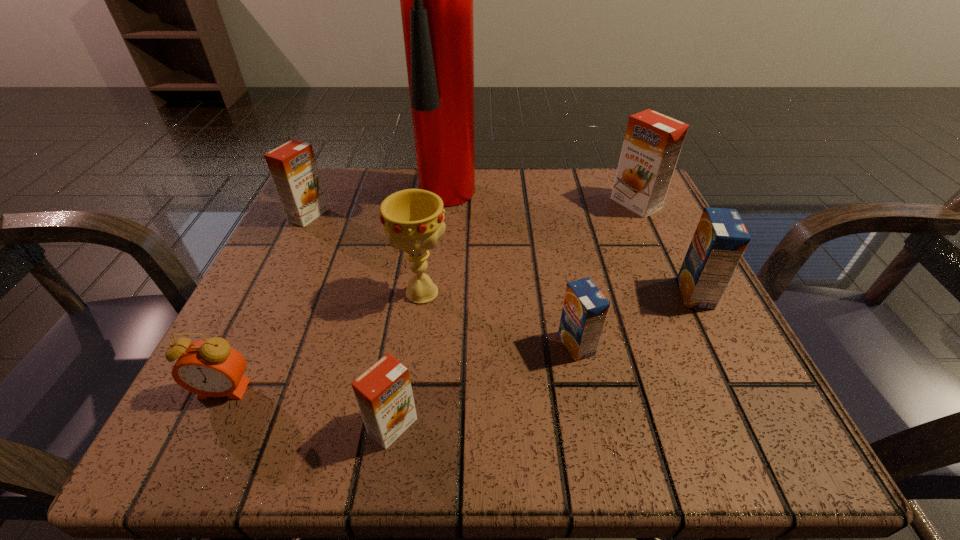
This screenshot has height=540, width=960. In order to click on the seventh farthest object in this screenshot , I will do `click(211, 368)`.

At what (x,y) coordinates should I click in order to perform the action: click on the sixth object from left to right. Please return your answer as a coordinate pair (x, y). The height and width of the screenshot is (540, 960). Looking at the image, I should click on (585, 308).

This screenshot has height=540, width=960. I want to click on the nearer blue orange_juice, so click(x=585, y=308).

The image size is (960, 540). In order to click on the nearest object in this screenshot , I will do `click(384, 395)`.

I want to click on the nearest orange juice, so click(x=384, y=395).

What are the coordinates of `vacant space located at the nozzle of the fire extinguisher` in the screenshot? It's located at (458, 339).

Identify the location of free space located on the front of the tallest orange juice. (667, 272).

The height and width of the screenshot is (540, 960). I want to click on vacant position located on the front of the chalice, so click(414, 355).

You are a GUI agent. You are given a task and a screenshot of the screen. Output one action in this format:
    pyautogui.click(x=<x>, y=<y>)
    Task: Click on the free space located 0.120m on the front of the second biggest orange orange juice
    The width and height of the screenshot is (960, 540).
    Given the screenshot: What is the action you would take?
    pyautogui.click(x=282, y=268)

You are a GUI agent. You are given a task and a screenshot of the screen. Output one action in this format:
    pyautogui.click(x=<x>, y=<y>)
    Task: Click on the vacant area situated 0.280m on the back of the right blue orange_juice
    
    Given the screenshot: What is the action you would take?
    pyautogui.click(x=643, y=190)